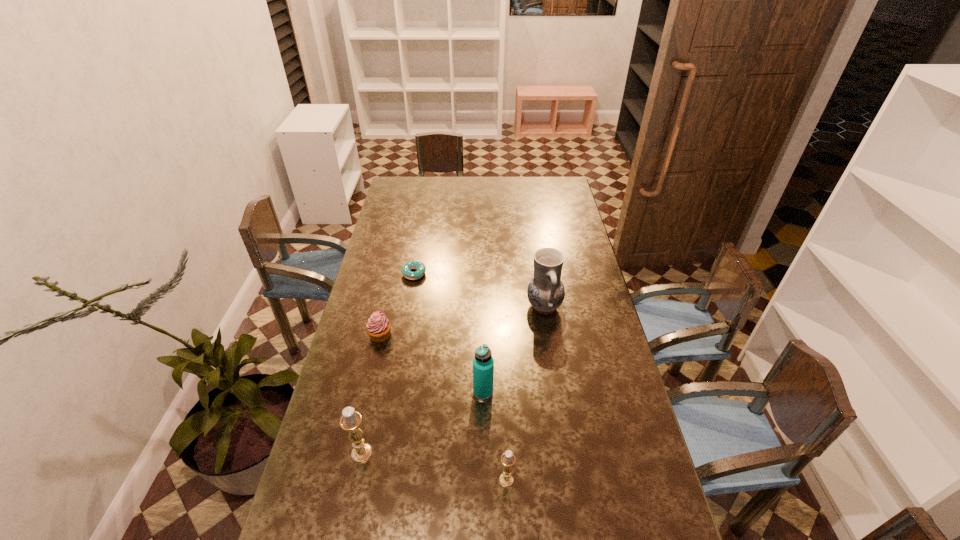
Where is `cupcake that is at the left edge`? The width and height of the screenshot is (960, 540). cupcake that is at the left edge is located at coordinates (378, 327).

Locate an element on the screen. object that is positioned at the right edge is located at coordinates (545, 292).

Where is `vacant region at the far edge`? vacant region at the far edge is located at coordinates (473, 193).

In the image, there is a desktop. At what (x,y) coordinates should I click in order to perform the action: click on vacant region at the near edge. Please return your answer as a coordinate pair (x, y). Image resolution: width=960 pixels, height=540 pixels. Looking at the image, I should click on (588, 535).

The height and width of the screenshot is (540, 960). In the image, there is a desktop. Find the location of `vacant space at the left edge`. vacant space at the left edge is located at coordinates (398, 221).

I want to click on free space at the right edge of the desktop, so click(x=607, y=366).

What are the coordinates of `vacant space at the far left corner` in the screenshot? It's located at (414, 185).

Locate an element on the screen. This screenshot has height=540, width=960. vacant space at the near right corner of the desktop is located at coordinates (638, 513).

Where is `vacant space that's between the fourth tallest object and the cupcake`? vacant space that's between the fourth tallest object and the cupcake is located at coordinates (444, 408).

You are a GUI agent. You are given a task and a screenshot of the screen. Output one action in this format:
    pyautogui.click(x=<x>, y=<y>)
    Task: Click on the vacant area that lies between the second shortest object and the rightmost object
    This screenshot has width=960, height=540.
    Given the screenshot: What is the action you would take?
    pyautogui.click(x=462, y=321)